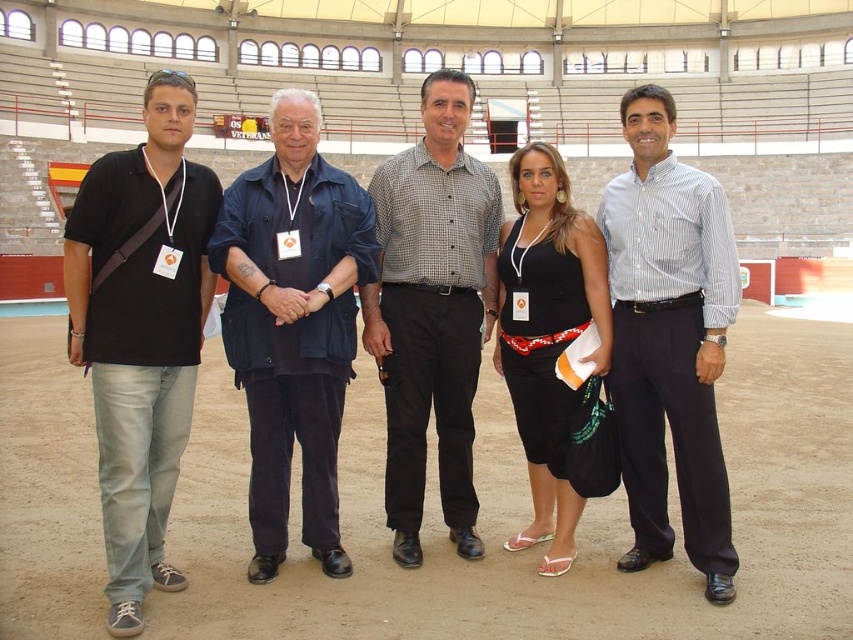
Question: Is white striped shirt at center further to the viewer compared to checkered shirt at center?

Choices:
 (A) yes
 (B) no

Answer: (B)

Question: Is white striped shirt at center to the left of checkered shirt at center from the viewer's perspective?

Choices:
 (A) no
 (B) yes

Answer: (A)

Question: Which point appears farthest from the camera in this image?

Choices:
 (A) (703, 371)
 (B) (332, 340)
 (C) (463, 397)
 (D) (534, 200)

Answer: (D)

Question: Which point is closer to the camera taking this photo?

Choices:
 (A) (434, 387)
 (B) (241, 323)
 (C) (131, 396)
 (D) (509, 548)

Answer: (C)

Question: Does white striped shirt at center have a larger size compared to checkered shirt at center?

Choices:
 (A) yes
 (B) no

Answer: (B)

Question: Which of the following is the closest to the observer?

Choices:
 (A) dark blue cotton shirt at center
 (B) checkered shirt at center

Answer: (A)